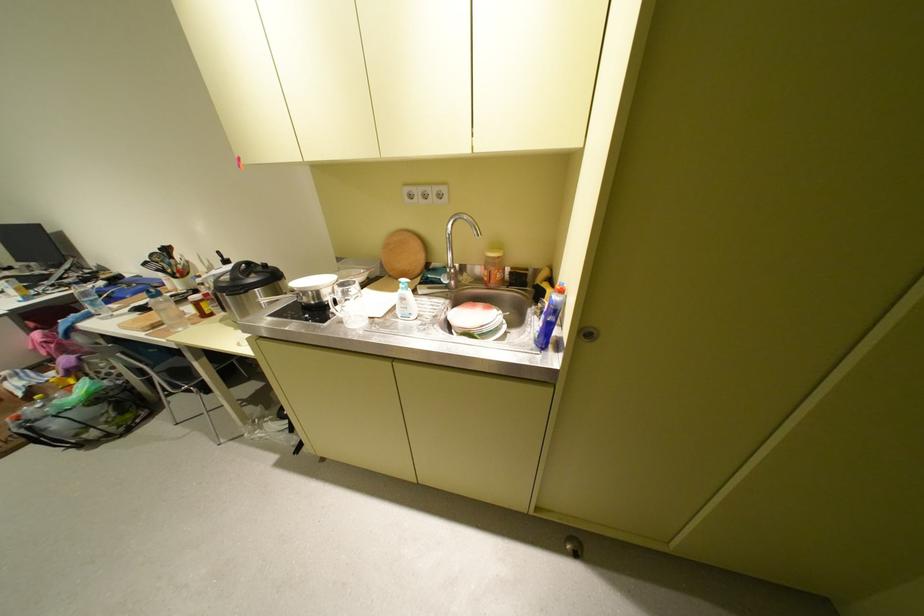
This screenshot has width=924, height=616. I want to click on glass mug handle, so click(x=333, y=302).